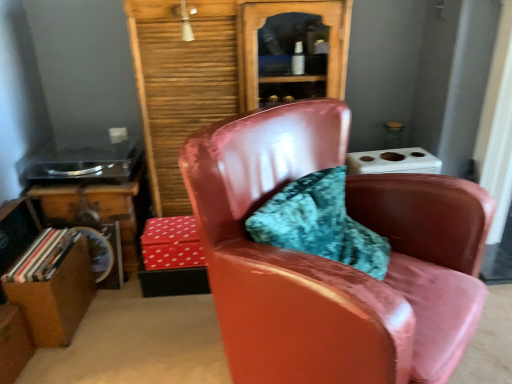
Question: Can you confirm if wooden table at lower left is bigger than glossy leather chair at center?

Choices:
 (A) yes
 (B) no

Answer: (B)

Question: Does wooden table at lower left have a smaller size compared to glossy leather chair at center?

Choices:
 (A) no
 (B) yes

Answer: (B)

Question: Is wooden table at lower left to the left of glossy leather chair at center from the viewer's perspective?

Choices:
 (A) no
 (B) yes

Answer: (B)

Question: Does wooden table at lower left have a greater width compared to glossy leather chair at center?

Choices:
 (A) yes
 (B) no

Answer: (B)

Question: From a real-world perspective, is wooden table at lower left beneath glossy leather chair at center?

Choices:
 (A) yes
 (B) no

Answer: (A)

Question: In the image, is matte gray power outlet at upper left positioned in front of or behind red dotted fabric box at center?

Choices:
 (A) front
 (B) behind

Answer: (B)

Question: Is matte gray power outlet at upper left taller or shorter than red dotted fabric box at center?

Choices:
 (A) short
 (B) tall

Answer: (A)

Question: Is point (124, 127) positioned closer to the camera than point (169, 266)?

Choices:
 (A) farther
 (B) closer

Answer: (A)

Question: Considering the relative positions of matte gray power outlet at upper left and red dotted fabric box at center in the image provided, is matte gray power outlet at upper left to the left or to the right of red dotted fabric box at center?

Choices:
 (A) right
 (B) left

Answer: (B)

Question: Considering the positions of matte gray power outlet at upper left and glossy leather chair at center in the image, is matte gray power outlet at upper left taller or shorter than glossy leather chair at center?

Choices:
 (A) short
 (B) tall

Answer: (A)

Question: Looking at their shapes, would you say matte gray power outlet at upper left is wider or thinner than glossy leather chair at center?

Choices:
 (A) wide
 (B) thin

Answer: (B)

Question: From a real-world perspective, is matte gray power outlet at upper left positioned above or below glossy leather chair at center?

Choices:
 (A) above
 (B) below

Answer: (A)

Question: From the image's perspective, is matte gray power outlet at upper left above or below glossy leather chair at center?

Choices:
 (A) above
 (B) below

Answer: (A)

Question: In terms of height, does wooden table at lower left look taller or shorter compared to red dotted fabric box at center?

Choices:
 (A) tall
 (B) short

Answer: (A)

Question: Is point (65, 208) positioned closer to the camera than point (146, 221)?

Choices:
 (A) farther
 (B) closer

Answer: (B)